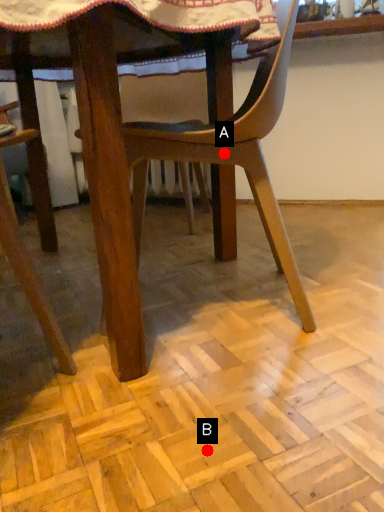
Question: Two points are circled on the image, labeled by A and B beside each circle. Which of the following is the closest to the observer?

Choices:
 (A) A is closer
 (B) B is closer

Answer: (B)